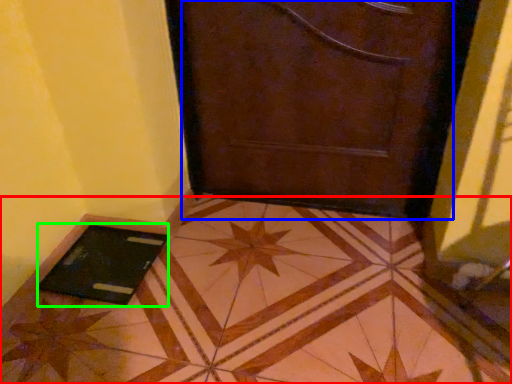
Question: Which is nearer to the tile (highlighted by a red box)? door (highlighted by a blue box) or tablet computer (highlighted by a green box).

Choices:
 (A) door
 (B) tablet computer

Answer: (B)